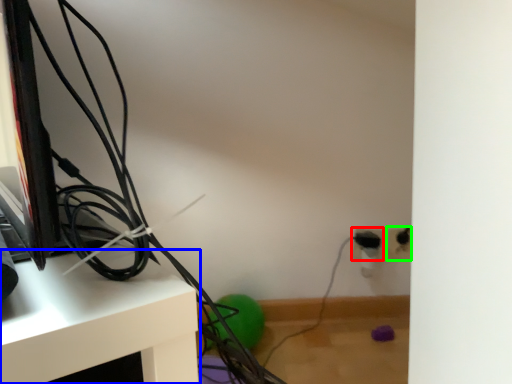
Question: Which is nearer to the electric outlet (highlighted by a red box)? furniture (highlighted by a blue box) or electric outlet (highlighted by a green box).

Choices:
 (A) furniture
 (B) electric outlet

Answer: (B)